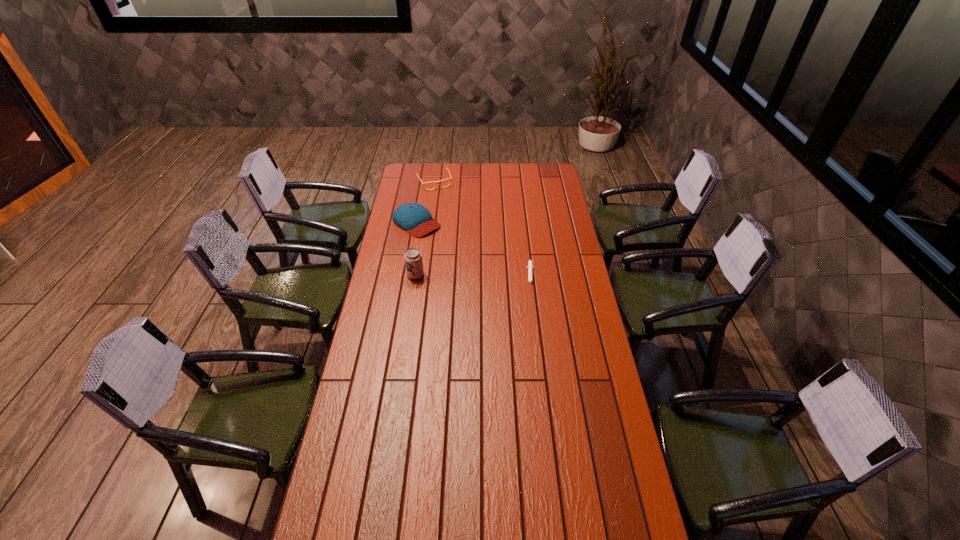
Where is `vacant region located in front of the lenses of the farthest object`? The height and width of the screenshot is (540, 960). vacant region located in front of the lenses of the farthest object is located at coordinates (456, 227).

Locate an element on the screen. The width and height of the screenshot is (960, 540). vacant region located 0.150m in front of the lenses of the farthest object is located at coordinates (445, 205).

Where is `free space located with the bill of the third shortest object facing forward`? free space located with the bill of the third shortest object facing forward is located at coordinates (461, 257).

This screenshot has width=960, height=540. Find the location of `vacant space located 0.190m with the bill of the third shortest object facing forward`. vacant space located 0.190m with the bill of the third shortest object facing forward is located at coordinates (455, 253).

You are a GUI agent. You are given a task and a screenshot of the screen. Output one action in this format:
    pyautogui.click(x=<x>, y=<y>)
    Task: Click on the vacant region located 0.130m with the bill of the third shortest object facing forward
    The height and width of the screenshot is (540, 960).
    Given the screenshot: What is the action you would take?
    pyautogui.click(x=447, y=247)

Image resolution: width=960 pixels, height=540 pixels. I want to click on object located at the far edge, so click(436, 182).

I want to click on beer can present at the left edge, so click(413, 258).

You are a GUI agent. You are given a task and a screenshot of the screen. Output one action in this format:
    pyautogui.click(x=<x>, y=<y>)
    Task: Click on the spectacles that is at the left edge
    The width and height of the screenshot is (960, 540).
    Given the screenshot: What is the action you would take?
    pyautogui.click(x=436, y=182)

I want to click on baseball cap situated at the left edge, so click(414, 218).

Locate an element on the screen. The image size is (960, 540). object at the far left corner is located at coordinates (436, 182).